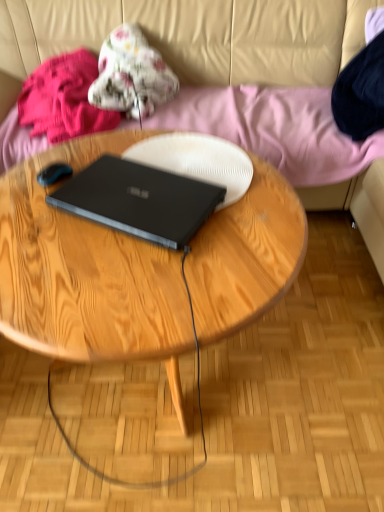
Locate an element on the screen. The width and height of the screenshot is (384, 512). free location to the right of black matte laptop at center is located at coordinates (255, 224).